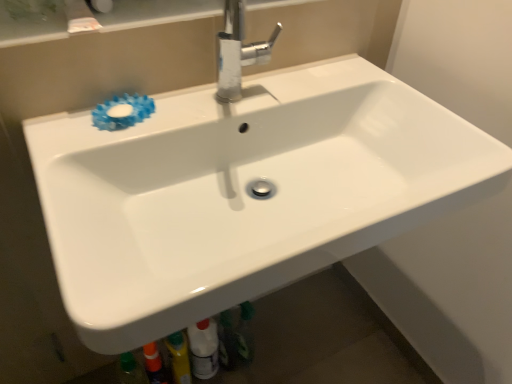
Find the location of a particular element. The height and width of the screenshot is (384, 512). vacant area that is situated to the right of polished chrome faucet at upper center is located at coordinates (312, 86).